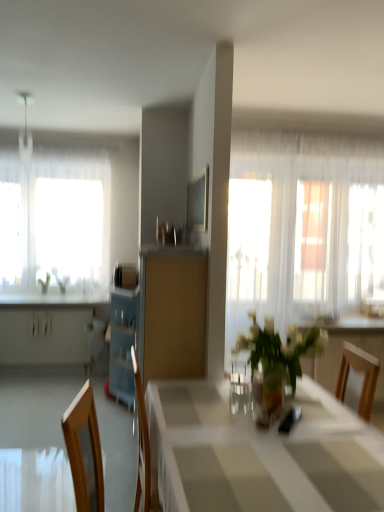
What do you see at coordinates (54, 298) in the screenshot?
I see `white glossy countertop at left` at bounding box center [54, 298].

Identify the location of green leafy plant at left. (61, 281).

Find the location of `wooden chair at right`. wooden chair at right is located at coordinates (357, 379).

What is the approximate height of matte wood cabinet at center?

matte wood cabinet at center is 1.51 meters in height.

Measure the distance between translucent glass vase at center and camera.

5.73 feet.

At what (x,y) coordinates should I click in order to perform the action: click on white glossy table at center. Please return your answer as a coordinate pair (x, y). Image resolution: width=384 pixels, height=512 pixels. Looking at the image, I should click on (260, 453).

In order to face white glossy table at center, should I rotate leftwards or rightwards?

Rotate right and turn 9.367 degrees.

The height and width of the screenshot is (512, 384). What are the coordinates of `white glossy countertop at left` in the screenshot? It's located at (54, 298).

Do you think green leafy plant at left is within translucent glass window at left, or outside of it?

green leafy plant at left is outside translucent glass window at left.

How much distance is there between green leafy plant at left and translucent glass window at left?

green leafy plant at left and translucent glass window at left are 24.74 inches apart from each other.

Would you say green leafy plant at left is a long distance from translucent glass window at left?

Actually, green leafy plant at left and translucent glass window at left are a little close together.

Who is bigger, green leafy plant at left or translucent glass window at left?

Answer: With larger size is translucent glass window at left.

Is white matte radiator at left positioned beyond the bounds of wooden chair at right?

Yes, white matte radiator at left is not within wooden chair at right.

Looking at their sizes, would you say white matte radiator at left is wider or thinner than wooden chair at right?

In the image, white matte radiator at left appears to be more narrow than wooden chair at right.

From a real-world perspective, between white matte radiator at left and wooden chair at right, who is vertically higher?

wooden chair at right.

How different are the orientations of white matte radiator at left and wooden chair at right in degrees?

white matte radiator at left and wooden chair at right are facing 2.62 degrees away from each other.

Consider the image. How distant is white glossy table at center from translucent glass window at left?

white glossy table at center is 3.06 meters from translucent glass window at left.

Which of these two, white glossy table at center or translucent glass window at left, stands shorter?

With less height is white glossy table at center.

Is white glossy table at center positioned far away from translucent glass window at left?

Yes, white glossy table at center is far from translucent glass window at left.

Visually, is white glossy table at center positioned to the left or to the right of translucent glass window at left?

Clearly, white glossy table at center is on the right of translucent glass window at left in the image.

Find the location of `chair that is behind the white glossy table at center`. chair that is behind the white glossy table at center is located at coordinates (357, 379).

From the image's perspective, who appears lower, white glossy table at center or wooden chair at right?

white glossy table at center appears lower in the image.

From a real-world perspective, is white glossy table at center below wooden chair at right?

No.

How far apart are white glossy table at center and wooden chair at right?

white glossy table at center and wooden chair at right are 27.51 inches apart from each other.

Is matte wood cabinet at center positioned in front of green leafy plant at left?

Yes, it is.

How many degrees apart are the facing directions of matte wood cabinet at center and green leafy plant at left?

matte wood cabinet at center and green leafy plant at left are facing 88.5 degrees away from each other.

In the scene shown: Considering the sizes of objects matte wood cabinet at center and green leafy plant at left in the image provided, who is bigger, matte wood cabinet at center or green leafy plant at left?

Bigger between the two is matte wood cabinet at center.

From the image's perspective, is matte wood cabinet at center above green leafy plant at left?

No, from the image's perspective, matte wood cabinet at center is not above green leafy plant at left.

Is translucent glass window at left behind white glossy table at center?

Yes, translucent glass window at left is further from the viewer.

Between translucent glass window at left and white glossy table at center, which one appears on the right side from the viewer's perspective?

white glossy table at center is more to the right.

From the image's perspective, between translucent glass window at left and white glossy table at center, who is located below?

white glossy table at center, from the image's perspective.

From the image's perspective, is green leafy plant at left located above or below white glossy table at center?

From the image's perspective, green leafy plant at left appears above white glossy table at center.

Considering the relative positions of green leafy plant at left and white glossy table at center in the image provided, is green leafy plant at left to the left or to the right of white glossy table at center?

Based on their positions, green leafy plant at left is located to the left of white glossy table at center.

Can you tell me how much green leafy plant at left and white glossy table at center differ in facing direction?

5.27 degrees.

Considering the sizes of green leafy plant at left and white glossy table at center in the image, is green leafy plant at left taller or shorter than white glossy table at center?

In the image, green leafy plant at left appears to be shorter than white glossy table at center.

The image size is (384, 512). What are the coordinates of `plant located underneath the translucent glass window at left (from a real-world perspective)` in the screenshot? It's located at (61, 281).

Image resolution: width=384 pixels, height=512 pixels. I want to click on chair that is above the white matte radiator at left (from a real-world perspective), so click(x=357, y=379).

Looking at the image, which one is located further to white glossy table at center, white glossy countertop at left or wooden chair at right?

Based on the image, white glossy countertop at left appears to be further to white glossy table at center.

When comparing their distances from white matte radiator at left, does white glossy countertop at left or wooden chair at right seem further?

wooden chair at right.

Based on their spatial positions, is translucent glass vase at center or matte wood cabinet at center further from wooden chair at right?

matte wood cabinet at center is further to wooden chair at right.

Based on their spatial positions, is white matte radiator at left or white glossy table at center further from white glossy countertop at left?

white glossy table at center.

Looking at this image, estimate the real-world distances between objects in this image. Which object is further from wooden chair at right, white matte radiator at left or green leafy plant at left?

white matte radiator at left is positioned further to the anchor wooden chair at right.

Estimate the real-world distances between objects in this image. Which object is closer to white matte radiator at left, white glossy table at center or wooden chair at right?

Among the two, white glossy table at center is located nearer to white matte radiator at left.

From the image, which object appears to be farther from translucent glass window at left, matte wood cabinet at center or white matte radiator at left?

matte wood cabinet at center lies further to translucent glass window at left than the other object.

Considering their positions, is green leafy plant at left positioned closer to translucent glass window at left than white glossy countertop at left?

Among the two, green leafy plant at left is located nearer to translucent glass window at left.

Image resolution: width=384 pixels, height=512 pixels. What are the coordinates of `chair positioned between white glossy table at center and translucent glass window at left from near to far` in the screenshot? It's located at pyautogui.click(x=357, y=379).

Find the location of a particular element. Image resolution: width=384 pixels, height=512 pixels. countertop between translucent glass vase at center and green leafy plant at left in the front-back direction is located at coordinates (54, 298).

I want to click on plant between translucent glass window at left and white matte radiator at left in the up-down direction, so click(61, 281).

Find the location of `houseplant between green leafy plant at left and wooden chair at right from left to right`. houseplant between green leafy plant at left and wooden chair at right from left to right is located at coordinates (278, 357).